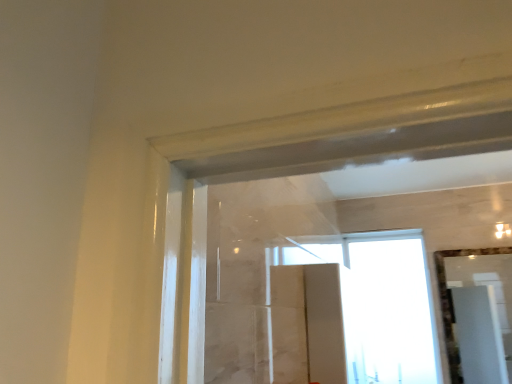
Describe the element at coordinates (359, 310) in the screenshot. I see `transparent glass window at upper center` at that location.

Identify the location of transparent glass window at upper center. This screenshot has width=512, height=384. (359, 310).

Looking at this image, what is the approximate height of transparent glass window at upper center?

transparent glass window at upper center is 97.08 centimeters in height.

Find the location of a particular element. clear glass mirror at upper right is located at coordinates (479, 317).

What do you see at coordinates (479, 317) in the screenshot? The width and height of the screenshot is (512, 384). I see `clear glass mirror at upper right` at bounding box center [479, 317].

At what (x,y) coordinates should I click in order to perform the action: click on transparent glass window at upper center. Please return your answer as a coordinate pair (x, y). Looking at the image, I should click on (359, 310).

Does clear glass mirror at upper right appear on the left side of transparent glass window at upper center?

No, clear glass mirror at upper right is not to the left of transparent glass window at upper center.

Is clear glass mirror at upper right in front of or behind transparent glass window at upper center in the image?

Clearly, clear glass mirror at upper right is in front of transparent glass window at upper center.

Does point (459, 308) appear closer or farther from the camera than point (407, 262)?

Clearly, point (459, 308) is more distant from the camera than point (407, 262).

From the image's perspective, is clear glass mirror at upper right located beneath transparent glass window at upper center?

No, from the image's perspective, clear glass mirror at upper right is not below transparent glass window at upper center.

From a real-world perspective, is clear glass mirror at upper right above or below transparent glass window at upper center?

In terms of real-world spatial position, clear glass mirror at upper right is below transparent glass window at upper center.

Considering the relative sizes of clear glass mirror at upper right and transparent glass window at upper center in the image provided, is clear glass mirror at upper right thinner than transparent glass window at upper center?

Correct, the width of clear glass mirror at upper right is less than that of transparent glass window at upper center.

Is clear glass mirror at upper right taller or shorter than transparent glass window at upper center?

In the image, clear glass mirror at upper right appears to be shorter than transparent glass window at upper center.

Can you confirm if clear glass mirror at upper right is bigger than transparent glass window at upper center?

No, clear glass mirror at upper right is not bigger than transparent glass window at upper center.

Is clear glass mirror at upper right spatially inside transparent glass window at upper center, or outside of it?

clear glass mirror at upper right is located beyond the bounds of transparent glass window at upper center.

Is clear glass mirror at upper right with transparent glass window at upper center?

No, clear glass mirror at upper right is not beside transparent glass window at upper center.

Could you tell me if clear glass mirror at upper right is facing transparent glass window at upper center?

No, clear glass mirror at upper right is not oriented towards transparent glass window at upper center.

Measure the distance between clear glass mirror at upper right and transparent glass window at upper center.

clear glass mirror at upper right and transparent glass window at upper center are 1.30 meters apart from each other.

Where is `window that is below the clear glass mirror at upper right (from the image's perspective)`? This screenshot has height=384, width=512. window that is below the clear glass mirror at upper right (from the image's perspective) is located at coordinates (359, 310).

Is transparent glass window at upper center to the right of clear glass mirror at upper right from the viewer's perspective?

No.

From the picture: Considering their positions, is transparent glass window at upper center located in front of or behind clear glass mirror at upper right?

Clearly, transparent glass window at upper center is behind clear glass mirror at upper right.

Between point (385, 309) and point (483, 341), which one is positioned in front?

The point (385, 309) is closer.

From the image's perspective, is transparent glass window at upper center located beneath clear glass mirror at upper right?

Yes, from the image's perspective, transparent glass window at upper center is beneath clear glass mirror at upper right.

From a real-world perspective, relative to clear glass mirror at upper right, is transparent glass window at upper center vertically above or below?

transparent glass window at upper center is situated higher than clear glass mirror at upper right in the real world.

Can you confirm if transparent glass window at upper center is wider than clear glass mirror at upper right?

Correct, the width of transparent glass window at upper center exceeds that of clear glass mirror at upper right.

Considering the sizes of objects transparent glass window at upper center and clear glass mirror at upper right in the image provided, who is shorter, transparent glass window at upper center or clear glass mirror at upper right?

With less height is clear glass mirror at upper right.

Consider the image. Considering the relative sizes of transparent glass window at upper center and clear glass mirror at upper right in the image provided, is transparent glass window at upper center bigger than clear glass mirror at upper right?

Yes.

Is clear glass mirror at upper right a part of transparent glass window at upper center?

No, clear glass mirror at upper right is not a part of transparent glass window at upper center.

Is transparent glass window at upper center positioned far away from clear glass mirror at upper right?

Yes.

Could you tell me if transparent glass window at upper center is facing clear glass mirror at upper right?

No, transparent glass window at upper center is not facing towards clear glass mirror at upper right.

Image resolution: width=512 pixels, height=384 pixels. Identify the location of mirror in front of the transparent glass window at upper center. (479, 317).

Locate an element on the screen. The image size is (512, 384). window below the clear glass mirror at upper right (from the image's perspective) is located at coordinates (359, 310).

The height and width of the screenshot is (384, 512). Identify the location of mirror below the transparent glass window at upper center (from a real-world perspective). (479, 317).